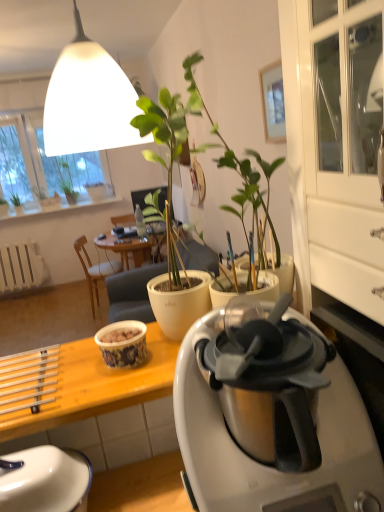
What do you see at coordinates (17, 204) in the screenshot? I see `green matte plant at upper left, the first houseplant when ordered from left to right` at bounding box center [17, 204].

Consider the image. What is the approximate width of yellow wood desk at lower left?

The width of yellow wood desk at lower left is 13.56 inches.

The image size is (384, 512). Describe the element at coordinates (98, 385) in the screenshot. I see `yellow wood desk at lower left` at that location.

Measure the distance between point (1,120) and camera.

A distance of 18.08 feet exists between point (1,120) and camera.

What do you see at coordinates (58, 207) in the screenshot? The image size is (384, 512). I see `white ceramic window sill at upper left` at bounding box center [58, 207].

Describe the element at coordinates (46, 480) in the screenshot. This screenshot has height=512, width=384. I see `white glossy kettle at lower left` at that location.

Where is `white matte radiator at lower left`? white matte radiator at lower left is located at coordinates (21, 267).

This screenshot has height=512, width=384. Identify the location of green matte plant at upper left, which is the third houseplant from right to left. (17, 204).

Based on the photo, is wooden chair at center with white matte radiator at lower left?

wooden chair at center and white matte radiator at lower left are clearly separated.

Is wooden chair at center to the left of white matte radiator at lower left from the viewer's perspective?

No.

How different are the orientations of wooden chair at center and white matte radiator at lower left in degrees?

The angle between the facing direction of wooden chair at center and the facing direction of white matte radiator at lower left is 1 degrees.

Which object is more forward, wooden chair at center or white matte radiator at lower left?

wooden chair at center.

From the image's perspective, is matte ceramic cup at center located above white ceramic window sill at upper left?

Actually, matte ceramic cup at center appears below white ceramic window sill at upper left in the image.

Can you confirm if matte ceramic cup at center is positioned to the right of white ceramic window sill at upper left?

Indeed, matte ceramic cup at center is positioned on the right side of white ceramic window sill at upper left.

Considering the relative sizes of matte ceramic cup at center and white ceramic window sill at upper left in the image provided, is matte ceramic cup at center bigger than white ceramic window sill at upper left?

Incorrect, matte ceramic cup at center is not larger than white ceramic window sill at upper left.

From the picture: Considering the sizes of objects matte ceramic cup at center and white ceramic window sill at upper left in the image provided, who is thinner, matte ceramic cup at center or white ceramic window sill at upper left?

matte ceramic cup at center is thinner.

From a real-world perspective, which is physically above, green matte plant at upper left, marked as the 1th houseplant in a right-to-left arrangement, or silver metallic coffee maker at center?

green matte plant at upper left, marked as the 1th houseplant in a right-to-left arrangement, is physically above.

Is silver metallic coffee maker at center at the back of green matte plant at upper left, marked as the 1th houseplant in a right-to-left arrangement?

No, green matte plant at upper left, marked as the 1th houseplant in a right-to-left arrangement, is not facing away from silver metallic coffee maker at center.

Between point (68, 189) and point (278, 507), which one is positioned in front?

The point (278, 507) is more forward.

Can you confirm if green matte plant at upper left, the third houseplant from the left, is positioned to the left of silver metallic coffee maker at center?

Yes.

Is green matte plant at upper left, marked as the 1th houseplant in a right-to-left arrangement, inside the boundaries of white matte lampshade at upper center, or outside?

green matte plant at upper left, marked as the 1th houseplant in a right-to-left arrangement, is located beyond the bounds of white matte lampshade at upper center.

Can you confirm if green matte plant at upper left, the third houseplant from the left, is thinner than white matte lampshade at upper center?

No.

Is green matte plant at upper left, the third houseplant from the left, next to white matte lampshade at upper center and touching it?

No.

Considering the positions of points (36, 275) and (111, 358), is point (36, 275) closer to camera compared to point (111, 358)?

No.

From a real-world perspective, is white matte radiator at lower left physically located above or below matte ceramic cup at center?

In terms of real-world spatial position, white matte radiator at lower left is below matte ceramic cup at center.

Could you tell me if white matte radiator at lower left is facing matte ceramic cup at center?

Yes, white matte radiator at lower left is facing matte ceramic cup at center.

Is white matte radiator at lower left taller or shorter than matte ceramic cup at center?

Considering their sizes, white matte radiator at lower left has more height than matte ceramic cup at center.

From the image's perspective, is matte ceramic cup at center under green matte plant at upper left, the first houseplant when ordered from left to right?

Correct, matte ceramic cup at center appears lower than green matte plant at upper left, the first houseplant when ordered from left to right, in the image.

Looking at this image, are matte ceramic cup at center and green matte plant at upper left, which is the third houseplant from right to left, located far from each other?

matte ceramic cup at center is far away from green matte plant at upper left, which is the third houseplant from right to left.

Do you think matte ceramic cup at center is within green matte plant at upper left, which is the third houseplant from right to left, or outside of it?

The correct answer is: outside.

How far apart are matte ceramic cup at center and green matte plant at upper left, the first houseplant when ordered from left to right?

They are 4.48 meters apart.

Is yellow wood desk at lower left situated inside silver metallic coffee maker at center or outside?

yellow wood desk at lower left is located beyond the bounds of silver metallic coffee maker at center.

Could you tell me if yellow wood desk at lower left is turned towards silver metallic coffee maker at center?

No, yellow wood desk at lower left is not turned towards silver metallic coffee maker at center.

Does yellow wood desk at lower left have a lesser height compared to silver metallic coffee maker at center?

Correct, yellow wood desk at lower left is not as tall as silver metallic coffee maker at center.

The width and height of the screenshot is (384, 512). What are the coordinates of `radiator above the wooden chair at center (from a real-world perspective)` in the screenshot? It's located at (21, 267).

Where is `coffee cup on the right of white ceramic window sill at upper left`? Image resolution: width=384 pixels, height=512 pixels. coffee cup on the right of white ceramic window sill at upper left is located at coordinates (123, 343).

Which object lies further to the anchor point white ceramic window sill at upper left, silver metallic coffee maker at center or white matte radiator at lower left?

Among the two, silver metallic coffee maker at center is located further to white ceramic window sill at upper left.

Estimate the real-world distances between objects in this image. Which object is closer to green matte plant at upper left, the first houseplant when ordered from left to right, silver metallic coffee maker at center or transparent plastic window screen at upper left?

transparent plastic window screen at upper left is closer to green matte plant at upper left, the first houseplant when ordered from left to right.

Estimate the real-world distances between objects in this image. Which object is further from white matte flowerpot at upper center, green matte plant at upper left, the third houseplant from the left, or yellow wood desk at lower left?

yellow wood desk at lower left is positioned further to the anchor white matte flowerpot at upper center.

From the image, which object appears to be nearer to green matte plant at upper left, the third houseplant from the left, white ceramic window sill at upper left or white matte lampshade at upper center?

white ceramic window sill at upper left is closer to green matte plant at upper left, the third houseplant from the left.

When comparing their distances from transparent plastic window screen at upper left, does wooden chair at center or white glossy kettle at lower left seem further?

white glossy kettle at lower left is further to transparent plastic window screen at upper left.

Estimate the real-world distances between objects in this image. Which object is further from white ceramic window sill at upper left, white matte radiator at lower left or wooden chair at center?

The object further to white ceramic window sill at upper left is wooden chair at center.

From the image, which object appears to be nearer to silver metallic coffee maker at center, yellow wood desk at lower left or wooden chair at center?

yellow wood desk at lower left is positioned closer to the anchor silver metallic coffee maker at center.

From the image, which object appears to be farther from silver metallic coffee maker at center, green matte plant at upper left, marked as the 1th houseplant in a right-to-left arrangement, or white matte radiator at lower left?

Among the two, green matte plant at upper left, marked as the 1th houseplant in a right-to-left arrangement, is located further to silver metallic coffee maker at center.

The width and height of the screenshot is (384, 512). I want to click on window screen situated between green matte plant at upper left, the first houseplant when ordered from left to right, and white matte flowerpot at upper center from left to right, so click(46, 169).

What are the coordinates of `radiator between green matte plant at upper left, the first houseplant when ordered from left to right, and wooden chair at center` in the screenshot? It's located at (21, 267).

Locate an element on the screen. radiator between yellow wood desk at lower left and green matte plant at upper left, which is counted as the 2th houseplant, starting from the left, along the z-axis is located at coordinates (21, 267).

At what (x,y) coordinates should I click in order to perform the action: click on coffee cup between white glossy kettle at lower left and green matte plant at upper left, marked as the 1th houseplant in a right-to-left arrangement, from front to back. Please return your answer as a coordinate pair (x, y). Image resolution: width=384 pixels, height=512 pixels. Looking at the image, I should click on (123, 343).